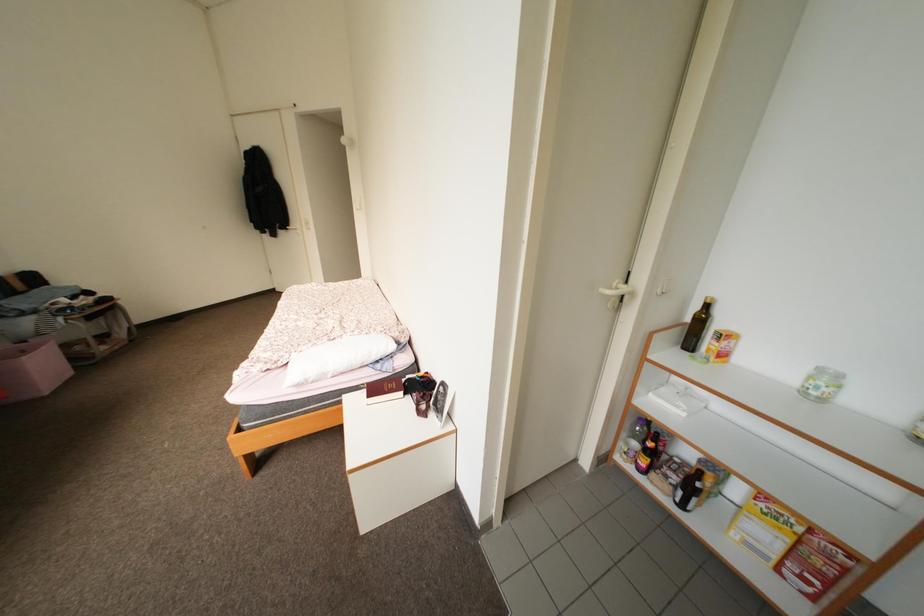
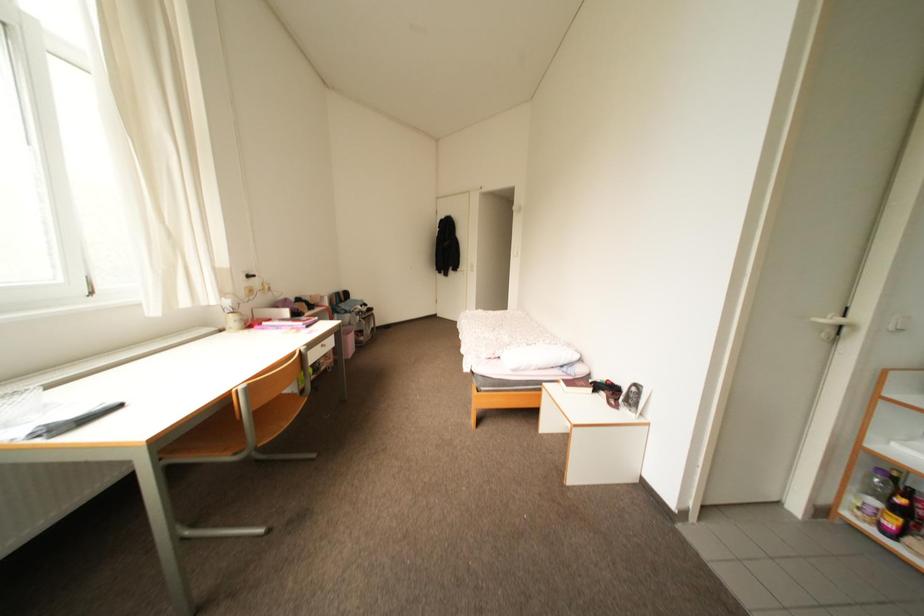
Which direction would the cameraman need to move to produce the second image?

The movement direction of the cameraman is left, backward.